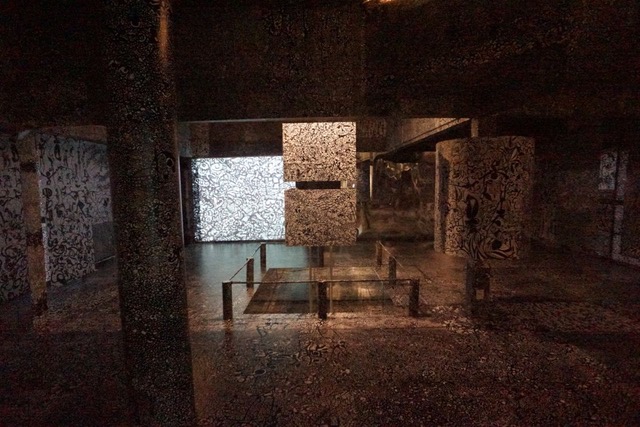
The width and height of the screenshot is (640, 427). Find the location of `air grate`. air grate is located at coordinates (104, 249).